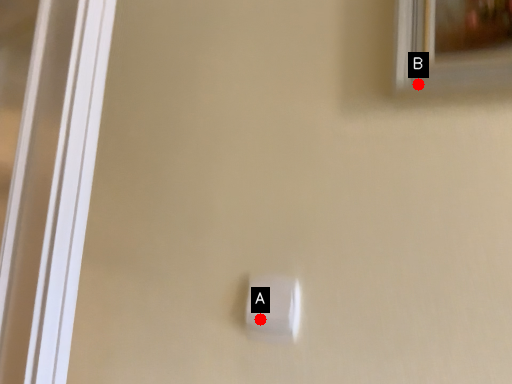
Question: Two points are circled on the image, labeled by A and B beside each circle. Which point is farther to the camera?

Choices:
 (A) A is further
 (B) B is further

Answer: (A)